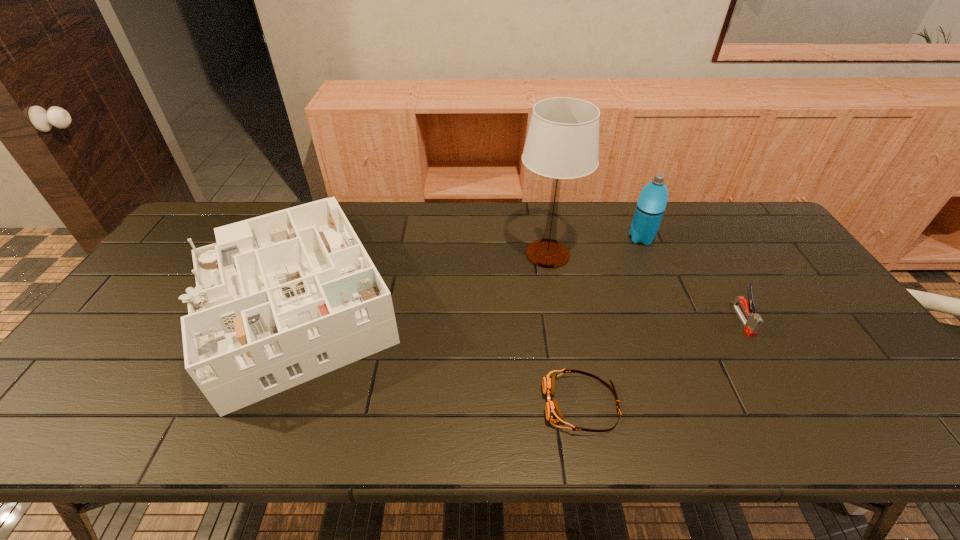
The image size is (960, 540). Find the location of `table lamp`. table lamp is located at coordinates (562, 142).

Find the location of a particular element. Image resolution: width=960 pixels, height=540 pixels. thermos bottle is located at coordinates (652, 201).

You are a GUI agent. You are given a task and a screenshot of the screen. Output one action in this format:
    pyautogui.click(x=<x>, y=<y>)
    Task: Click on the second tallest object
    This screenshot has width=960, height=540.
    Given the screenshot: What is the action you would take?
    pyautogui.click(x=652, y=201)

Identify the location of dollhouse. (280, 299).

Find the location of a particular element. This screenshot has height=540, width=960. the leftmost object is located at coordinates (280, 299).

Locate an element on the screen. The height and width of the screenshot is (540, 960). the rightmost object is located at coordinates (751, 326).

What are the coordinates of `the second shortest object` in the screenshot? It's located at (751, 326).

Locate an element on the screen. the shortest object is located at coordinates (553, 413).

This screenshot has width=960, height=540. Find the location of `vacant space located above the cylindrical shade of the table lamp`. vacant space located above the cylindrical shade of the table lamp is located at coordinates (555, 298).

Locate an element on the screen. The height and width of the screenshot is (540, 960). free space located 0.310m on the front of the fourth shortest object is located at coordinates (677, 320).